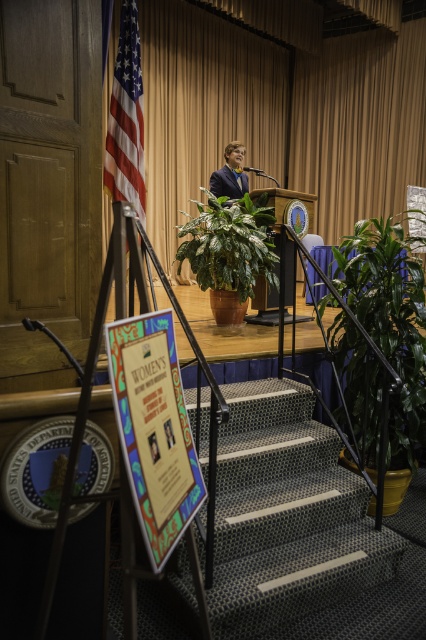
Consider the image. You are an event planner setting up for a ceremony. You need to place a 3.5 meter long decorative banner between the matte gold curtain at upper center and the green carpeted stairs at center. Will the banner fit without overlapping either object?

The distance between the matte gold curtain at upper center and the green carpeted stairs at center is 7.68 meters. Since the banner is only 3.5 meters long, it will fit comfortably between them without overlapping either object.

You are a guest at this event and want to take a photo of the green leafy plant at center and the matte blue suit at center. Which object should you focus on first if you want to capture both in the same frame without moving your camera?

You should focus on the matte blue suit at center first because the green leafy plant at center is to the right of it, so by centering the matte blue suit at center, the plant will naturally fall into the frame to its right.

You are an event planner setting up a camera to capture the matte gold curtain at upper center during the event. Where should you position the camera to ensure the curtain is in the frame?

The matte gold curtain at upper center is located at point (204,106), so position the camera to focus on that coordinate to include the curtain in the frame.